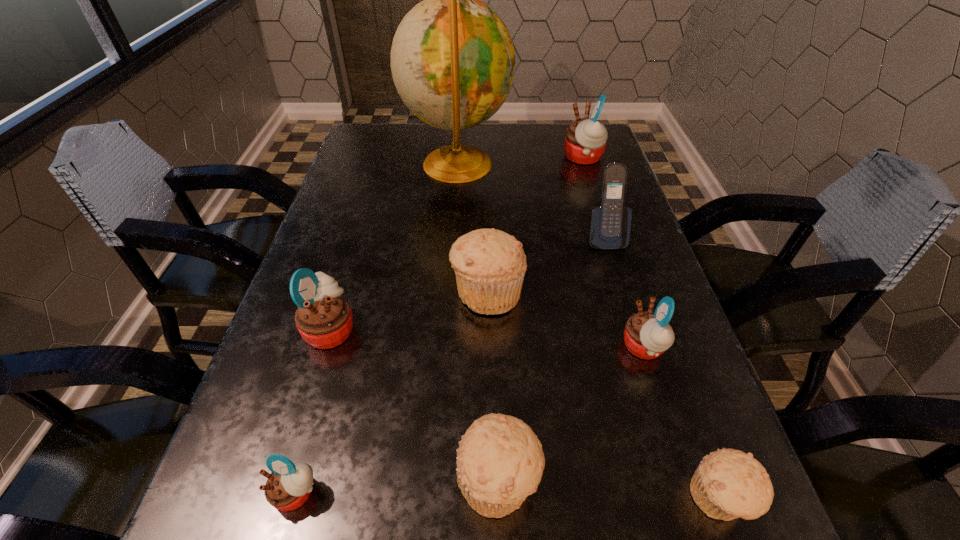
Where is `free spot at the right edge of the desktop`? This screenshot has width=960, height=540. free spot at the right edge of the desktop is located at coordinates (610, 284).

Image resolution: width=960 pixels, height=540 pixels. I want to click on empty location between the nearest pink muffin and the cellular telephone, so click(x=450, y=365).

This screenshot has width=960, height=540. I want to click on vacant space in between the third farthest object and the rightmost beige muffin, so click(x=662, y=368).

You are a GUI agent. You are given a task and a screenshot of the screen. Output one action in this format:
    pyautogui.click(x=<x>, y=<y>)
    Task: Click on the vacant area that lies between the smallest pink muffin and the second smallest beige muffin
    The image size is (960, 540).
    Given the screenshot: What is the action you would take?
    pyautogui.click(x=397, y=486)

Where is `vacant space that's between the nearest pink muffin and the farthest muffin`? vacant space that's between the nearest pink muffin and the farthest muffin is located at coordinates (440, 325).

The image size is (960, 540). I want to click on free spot between the second biggest beige muffin and the farthest beige muffin, so pyautogui.click(x=492, y=386).

This screenshot has width=960, height=540. I want to click on free area in between the rightmost beige muffin and the biggest beige muffin, so click(604, 395).

Where is `free space that is in between the rightmost beige muffin and the seventh nearest object`? The width and height of the screenshot is (960, 540). free space that is in between the rightmost beige muffin and the seventh nearest object is located at coordinates (662, 368).

Where is `free space between the biggest beige muffin and the tallest object`? Image resolution: width=960 pixels, height=540 pixels. free space between the biggest beige muffin and the tallest object is located at coordinates [472, 228].

The image size is (960, 540). What are the coordinates of `object that is the second nearest to the rightmost beige muffin` in the screenshot? It's located at (500, 461).